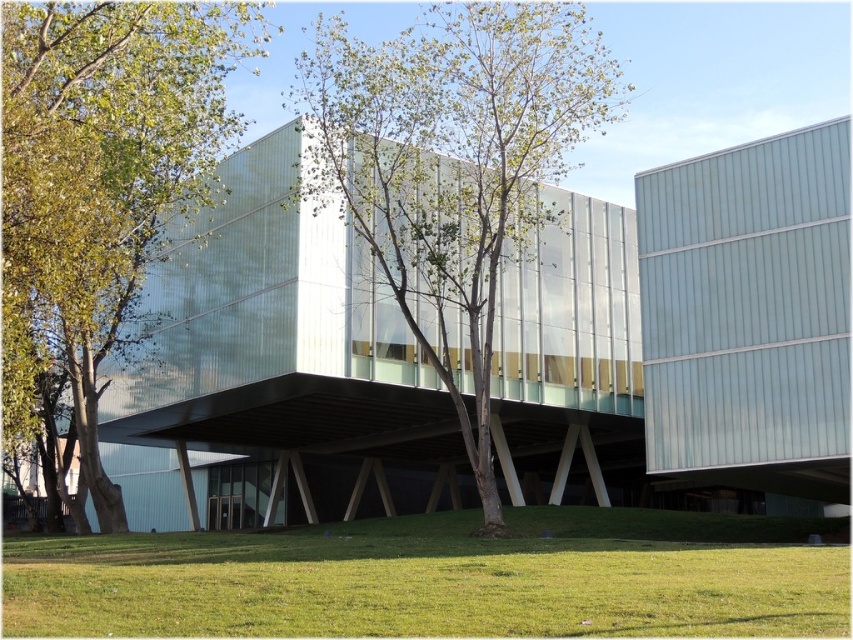
Question: Is green grass at lower center wider than green leafy tree at center?

Choices:
 (A) no
 (B) yes

Answer: (B)

Question: Which point appears farthest from the camera in this image?

Choices:
 (A) (85, 13)
 (B) (343, 115)

Answer: (B)

Question: Which of the following is the closest to the observer?

Choices:
 (A) (469, 547)
 (B) (409, 264)
 (C) (93, 93)

Answer: (A)

Question: Which object is farther from the camera taking this photo?

Choices:
 (A) green leafy tree at center
 (B) green leafy tree at left
 (C) green grass at lower center

Answer: (A)

Question: Can you confirm if green grass at lower center is wider than green leafy tree at left?

Choices:
 (A) no
 (B) yes

Answer: (B)

Question: In this image, where is green leafy tree at center located relative to green leafy tree at left?

Choices:
 (A) left
 (B) right

Answer: (B)